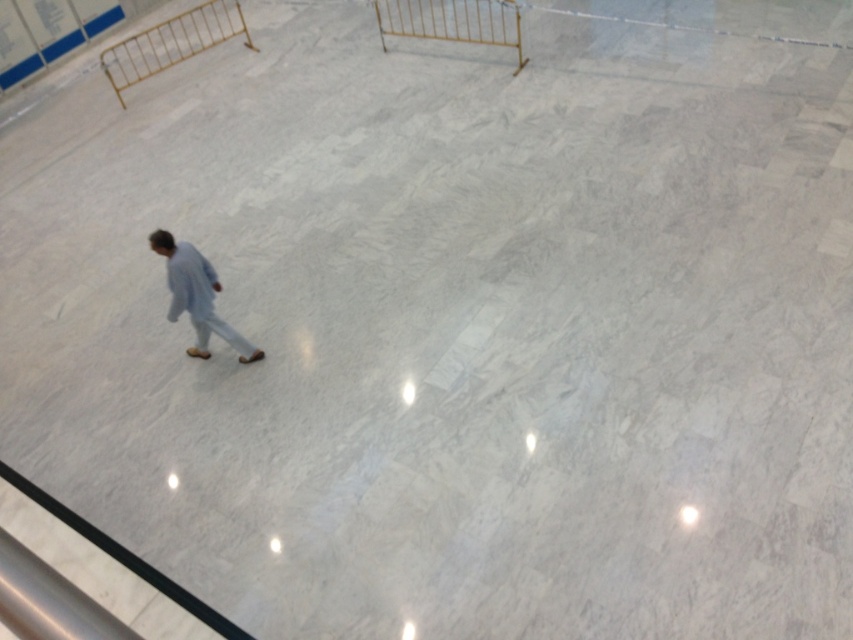
Question: Does gold metallic rail at upper center come behind light blue fabric at center?

Choices:
 (A) yes
 (B) no

Answer: (A)

Question: Does gold metallic rail at upper left appear under light blue fabric at center?

Choices:
 (A) yes
 (B) no

Answer: (B)

Question: Which object appears closest to the camera in this image?

Choices:
 (A) gold metallic rail at upper left
 (B) gold metallic rail at upper center

Answer: (B)

Question: Which object is farther from the camera taking this photo?

Choices:
 (A) gold metallic rail at upper left
 (B) gold metallic rail at upper center

Answer: (A)

Question: Which object is positioned farthest from the gold metallic rail at upper left?

Choices:
 (A) light blue fabric at center
 (B) gold metallic rail at upper center

Answer: (A)

Question: Does gold metallic rail at upper center appear on the right side of light blue fabric at center?

Choices:
 (A) yes
 (B) no

Answer: (A)